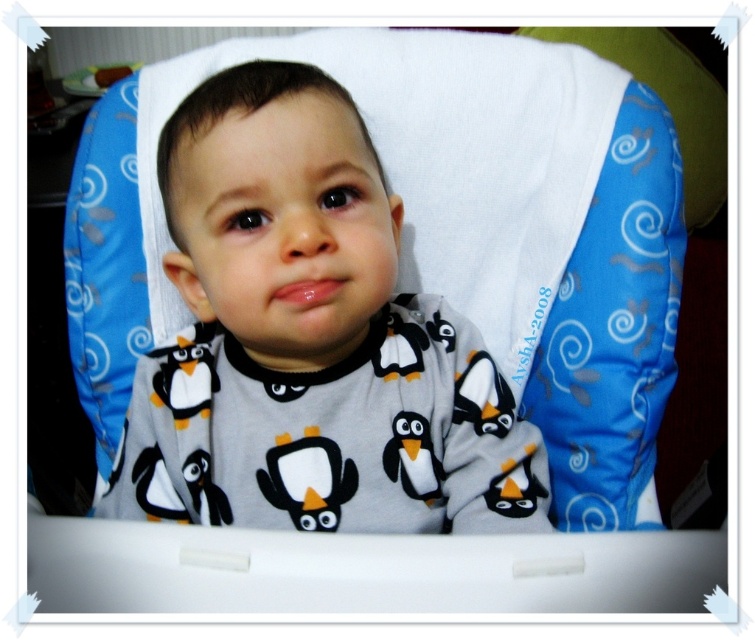
You are a parent trying to choose a toy for your child. You see the black fabric penguin at center and the white plush penguin at center. Which one is taller?

The black fabric penguin at center is taller than the white plush penguin at center.

You are a parent trying to clean up toys in the kitchen. You see the black fabric penguin at center and the white plush penguin at center on the high chair tray. Which penguin should you pick up first if you want to start with the one closer to the ground?

You should pick up the black fabric penguin at center first because it is located below the white plush penguin at center, making it closer to the ground.